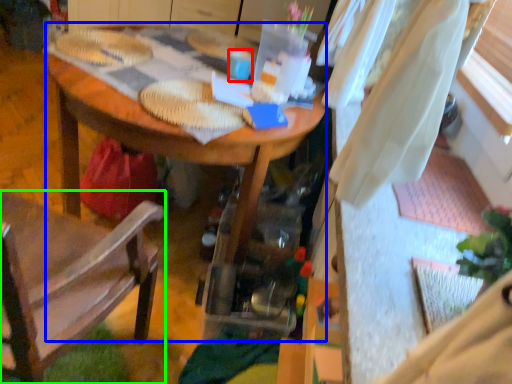
Question: Estimate the real-world distances between objects in this image. Which object is farther from coffee cup (highlighted by a red box), desk (highlighted by a blue box) or chair (highlighted by a green box)?

Choices:
 (A) desk
 (B) chair

Answer: (B)